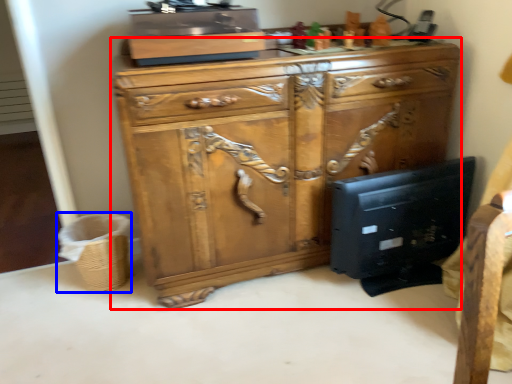
Question: Which object appears closest to the camera in this image, chest of drawers (highlighted by a red box) or basket (highlighted by a blue box)?

Choices:
 (A) chest of drawers
 (B) basket

Answer: (A)